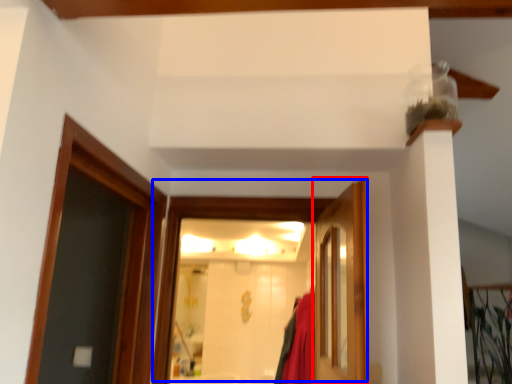
Question: Which of the following is the farthest to the observer, door (highlighted by a red box) or door (highlighted by a blue box)?

Choices:
 (A) door
 (B) door

Answer: (B)